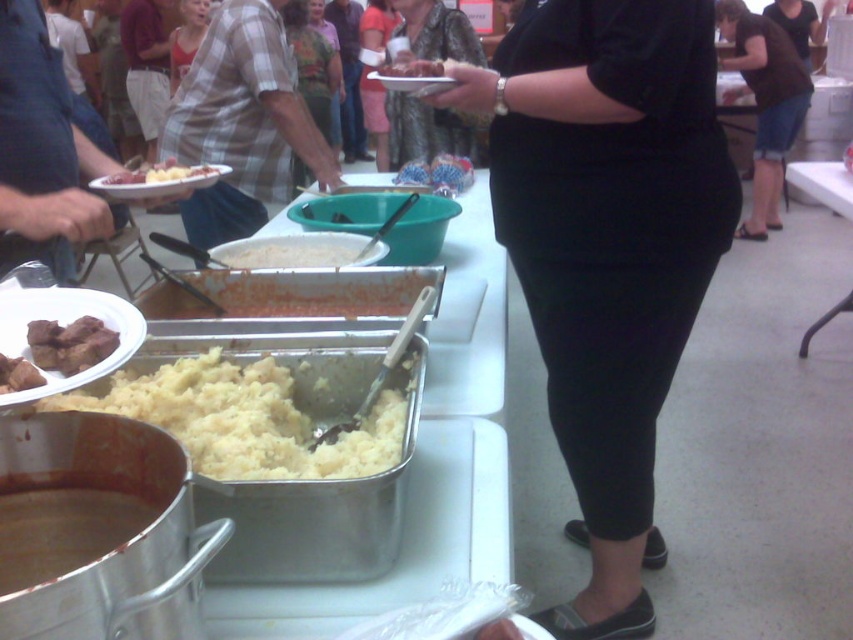
Can you confirm if black matte pants at center is bigger than brown meat at center?

Indeed, black matte pants at center has a larger size compared to brown meat at center.

Between black matte pants at center and brown meat at center, which one is positioned lower?

black matte pants at center is below.

Is point (659, 284) less distant than point (444, 72)?

Yes, point (659, 284) is closer to viewer.

The width and height of the screenshot is (853, 640). I want to click on black matte pants at center, so click(607, 250).

Who is positioned more to the left, leather jacket at center or white creamy mashed potatoes at center?

Answer: white creamy mashed potatoes at center

Who is shorter, leather jacket at center or white creamy mashed potatoes at center?

Standing shorter between the two is white creamy mashed potatoes at center.

Between point (408, 118) and point (341, 264), which one is positioned behind?

Point (408, 118)

Image resolution: width=853 pixels, height=640 pixels. Find the location of `leather jacket at center`. leather jacket at center is located at coordinates (426, 131).

Which is behind, point (300, 262) or point (438, 65)?

Positioned behind is point (300, 262).

Between point (276, 243) and point (381, 68), which one is positioned in front?

Point (381, 68) is more forward.

Locate an element on the screen. The width and height of the screenshot is (853, 640). white creamy mashed potatoes at center is located at coordinates (289, 252).